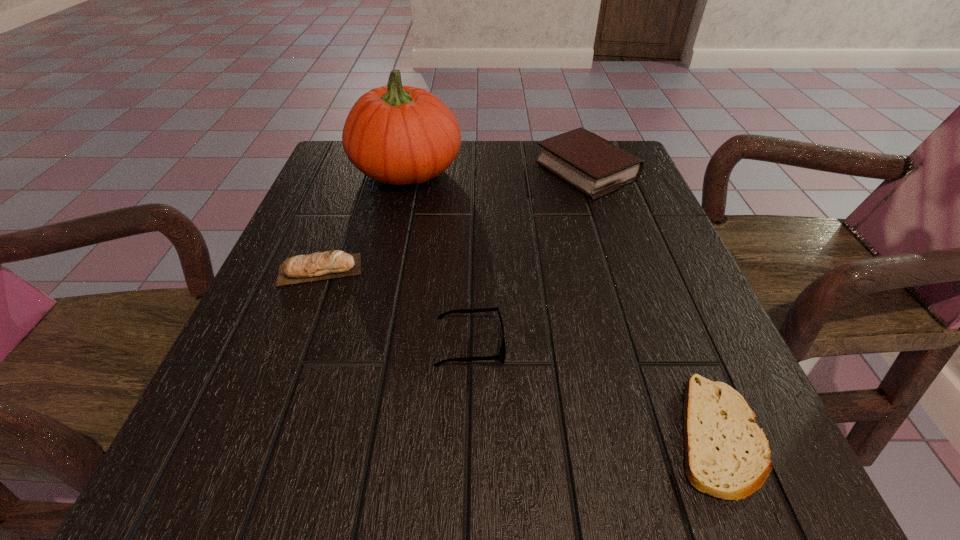
This screenshot has width=960, height=540. What are the coordinates of `vacant space that satisfies the following two spatial constraints: 1. on the back side of the farther pita bread; 2. on the right side of the tallest object` in the screenshot? It's located at (358, 170).

You are a GUI agent. You are given a task and a screenshot of the screen. Output one action in this format:
    pyautogui.click(x=<x>, y=<y>)
    Task: Click on the vacant area in the image that satisfies the following two spatial constraints: 1. on the front side of the Bible; 2. on the left side of the pumpkin
    This screenshot has height=540, width=960.
    Given the screenshot: What is the action you would take?
    pyautogui.click(x=406, y=171)

Where is `vacant space that satisfies the following two spatial constraints: 1. on the front side of the farther pita bread; 2. on the left side of the shortest object`? This screenshot has height=540, width=960. vacant space that satisfies the following two spatial constraints: 1. on the front side of the farther pita bread; 2. on the left side of the shortest object is located at coordinates tap(257, 435).